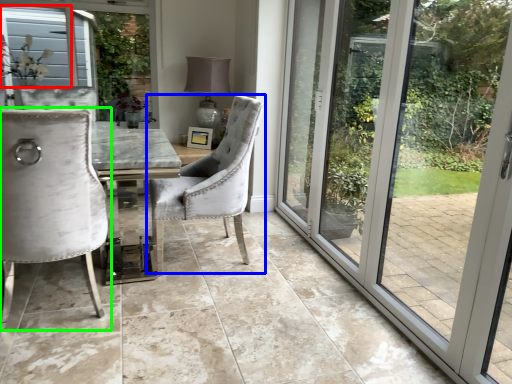
Question: Estimate the real-world distances between objects in this image. Which object is closer to window screen (highlighted by a red box), chair (highlighted by a blue box) or chair (highlighted by a green box)?

Choices:
 (A) chair
 (B) chair

Answer: (A)